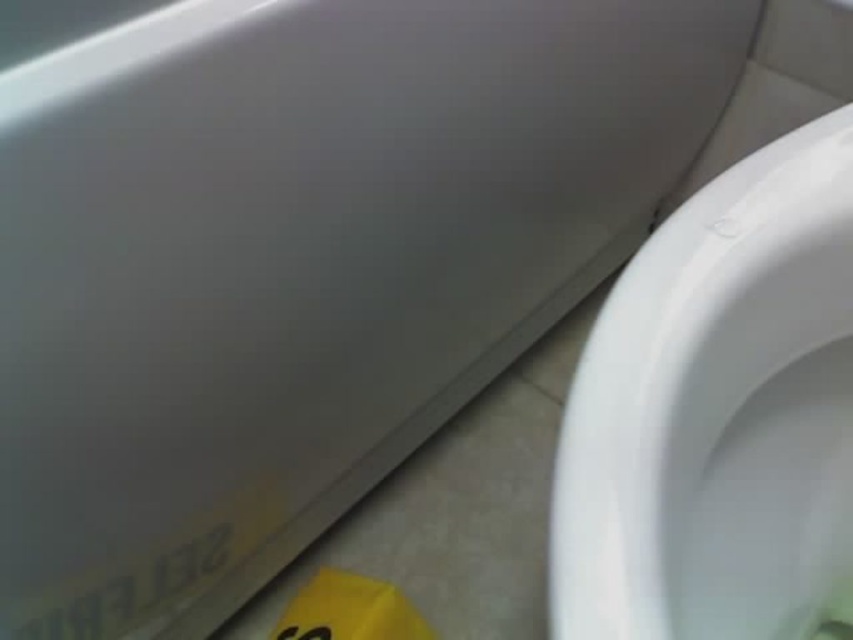
You are a bathroom cleaner who needs to reach both the white glossy toilet bowl at right and the yellow paper at lower left. Which object is taller and requires more effort to clean?

The white glossy toilet bowl at right is much taller than the yellow paper at lower left, so it requires more effort to clean.

You are a bathroom inspector checking the placement of safety labels. You see the white glossy toilet bowl at right and the yellow paper at lower left. Which object is positioned to the right of the other?

The white glossy toilet bowl at right is to the right of the yellow paper at lower left.

You are a maintenance worker inspecting the bathroom. You notice the white glossy toilet bowl at right and the yellow paper at lower left. Which object is positioned higher in the image?

The white glossy toilet bowl at right is above the yellow paper at lower left, so it is positioned higher in the image.